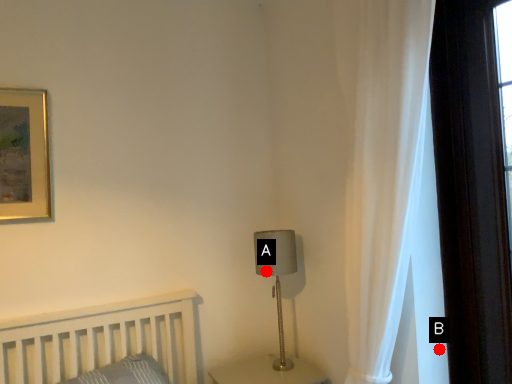
Question: Two points are circled on the image, labeled by A and B beside each circle. Which point is farther from the camera taking this photo?

Choices:
 (A) A is further
 (B) B is further

Answer: (A)